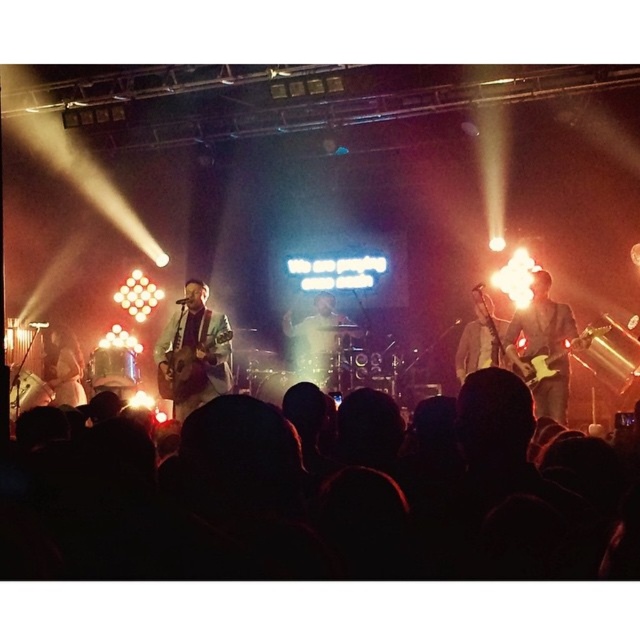
Does white matte microphone at center have a larger size compared to white fabric shirt at left?

Yes.

Does white matte microphone at center come behind white fabric shirt at left?

Yes, white matte microphone at center is further from the viewer.

This screenshot has width=640, height=640. In order to click on white matte microphone at center in this screenshot , I will do `click(316, 340)`.

This screenshot has width=640, height=640. Identify the location of white matte microphone at center. (316, 340).

Is matte light blue jacket at center to the left of white matte microphone at center from the viewer's perspective?

Correct, you'll find matte light blue jacket at center to the left of white matte microphone at center.

Between point (193, 406) and point (298, 358), which one is positioned in front?

Point (193, 406)

Locate an element on the screen. matte light blue jacket at center is located at coordinates (193, 353).

Can you confirm if matte light blue jacket at center is positioned below matte brown guitar at right?

Yes.

Does matte light blue jacket at center appear on the right side of matte brown guitar at right?

No, matte light blue jacket at center is not to the right of matte brown guitar at right.

Image resolution: width=640 pixels, height=640 pixels. In order to click on matte light blue jacket at center in this screenshot , I will do `click(193, 353)`.

You are a GUI agent. You are given a task and a screenshot of the screen. Output one action in this format:
    pyautogui.click(x=<x>, y=<y>)
    Task: Click on the matte light blue jacket at center
    
    Given the screenshot: What is the action you would take?
    pyautogui.click(x=193, y=353)